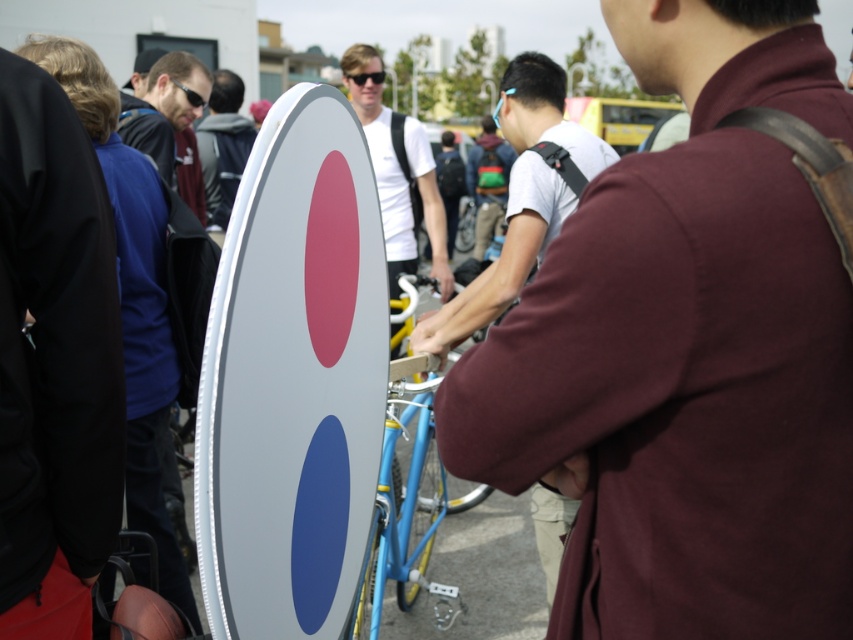
Question: Does green backpack at center have a lesser width compared to dark gray backpack at center?

Choices:
 (A) no
 (B) yes

Answer: (A)

Question: Which is farther from the white matte t-shirt at center?

Choices:
 (A) matte black jacket at upper left
 (B) dark gray backpack at center

Answer: (B)

Question: Is white matte t-shirt at center positioned before dark gray backpack at center?

Choices:
 (A) yes
 (B) no

Answer: (A)

Question: Considering the real-world distances, which object is farthest from the white matte shirt at center?

Choices:
 (A) maroon fabric shirt at upper right
 (B) white matte t-shirt at center

Answer: (A)

Question: Is white matte t-shirt at center smaller than green backpack at center?

Choices:
 (A) yes
 (B) no

Answer: (A)

Question: Among these objects, which one is nearest to the camera?

Choices:
 (A) maroon fabric shirt at upper right
 (B) green backpack at center

Answer: (A)